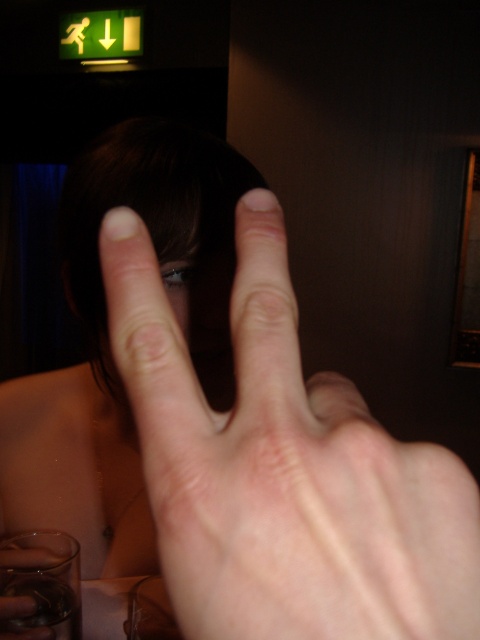
From the picture: Does pale skin hand at center lie behind clear glass at lower left?

No, pale skin hand at center is in front of clear glass at lower left.

Between pale skin hand at center and clear glass at lower left, which one is positioned higher?

Positioned higher is pale skin hand at center.

Describe the element at coordinates (282, 467) in the screenshot. The image size is (480, 640). I see `pale skin hand at center` at that location.

Identify the location of pale skin hand at center. (282, 467).